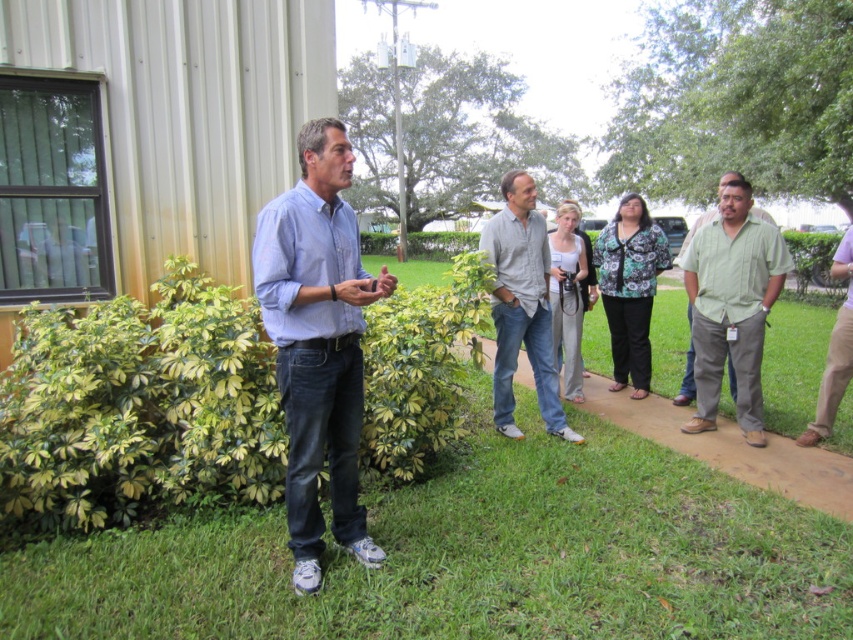
Question: Which object is farther from the camera taking this photo?

Choices:
 (A) gray cotton shirt at center
 (B) denim jeans at center
 (C) green grass at center

Answer: (A)

Question: Can you confirm if denim jeans at center is smaller than green cotton shirt at right?

Choices:
 (A) no
 (B) yes

Answer: (B)

Question: Estimate the real-world distances between objects in this image. Which object is farther from the denim jeans at center?

Choices:
 (A) gray cotton shirt at center
 (B) green grass at center
 (C) green cotton shirt at right

Answer: (C)

Question: Which of the following is the closest to the observer?

Choices:
 (A) green cotton shirt at right
 (B) denim jeans at center

Answer: (B)

Question: Does green grass at center have a lesser width compared to gray cotton shirt at center?

Choices:
 (A) yes
 (B) no

Answer: (B)

Question: Can you confirm if green cotton shirt at right is positioned to the right of gray cotton shirt at center?

Choices:
 (A) no
 (B) yes

Answer: (B)